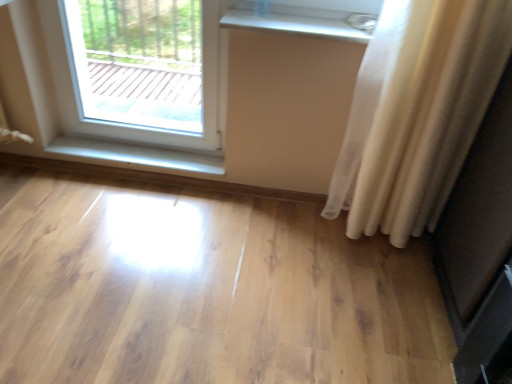
Where is `free location above light wood floor at center (from a real-world perspective)`? This screenshot has height=384, width=512. free location above light wood floor at center (from a real-world perspective) is located at coordinates (210, 267).